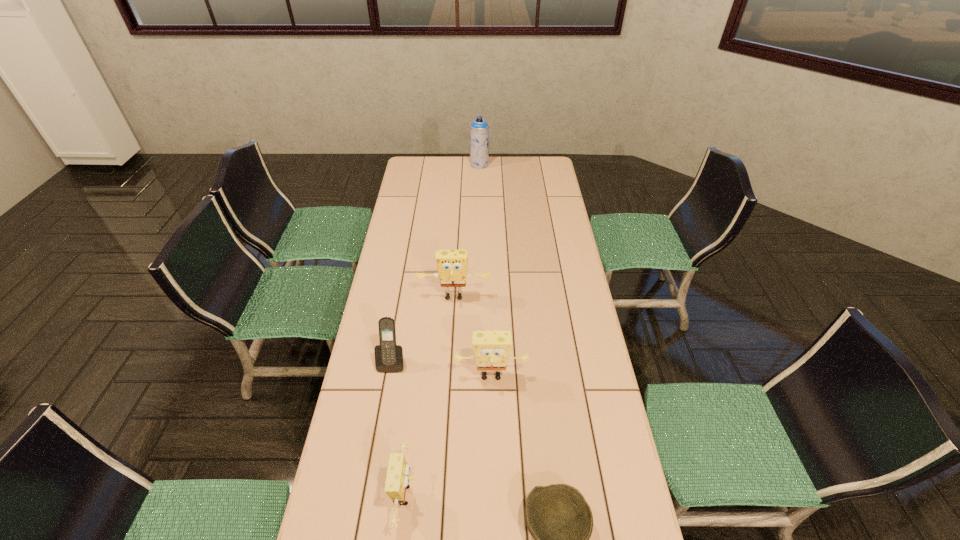
Where is `the tallest object`? The height and width of the screenshot is (540, 960). the tallest object is located at coordinates click(x=479, y=129).

Find the location of `aerosol can`. aerosol can is located at coordinates (479, 129).

At what (x,y) coordinates should I click in order to perform the action: click on the fifth nearest object. Please return your answer as a coordinate pair (x, y). This screenshot has width=960, height=540. Looking at the image, I should click on (452, 265).

I want to click on the second tallest sponge, so click(x=491, y=349).

I want to click on cellular telephone, so click(x=388, y=356).

This screenshot has width=960, height=540. Identify the location of vacant region located on the right of the tallest object. (500, 164).

Locate an element on the screen. The image size is (960, 540). free space located on the face of the fifth nearest object is located at coordinates (453, 318).

Locate an element on the screen. This screenshot has width=960, height=540. free space located on the face of the second shortest sponge is located at coordinates (492, 448).

You are a GUI agent. You are given a task and a screenshot of the screen. Output one action in this format:
    pyautogui.click(x=<x>, y=<y>)
    Task: Click on the free space located 0.380m on the front-facing side of the leftmost object
    
    Given the screenshot: What is the action you would take?
    pyautogui.click(x=370, y=494)

This screenshot has height=540, width=960. Find the location of `object positioned at the far edge`. object positioned at the far edge is located at coordinates (479, 129).